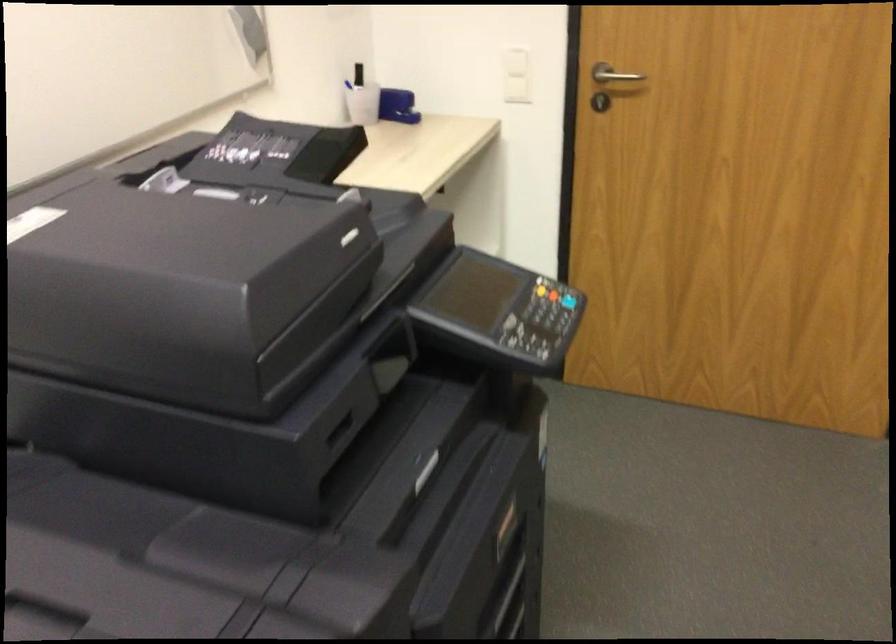
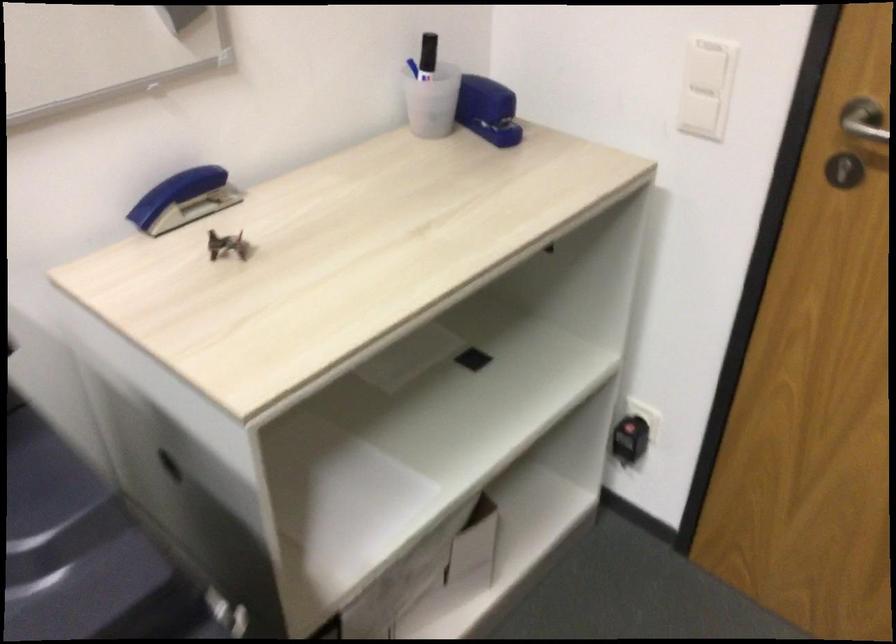
Locate, in the second image, the point that corresponds to the point at 523,73 in the first image.

(707, 87)